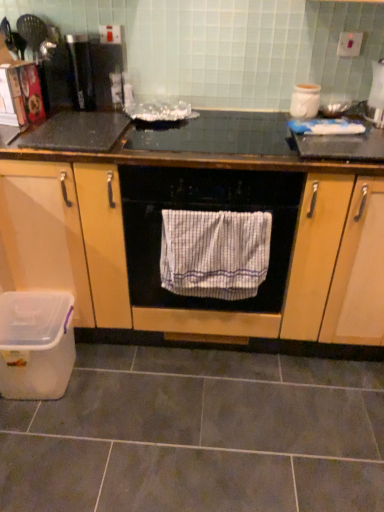
Where is `vacant space in front of transparent plastic container at lower left`? vacant space in front of transparent plastic container at lower left is located at coordinates (43, 442).